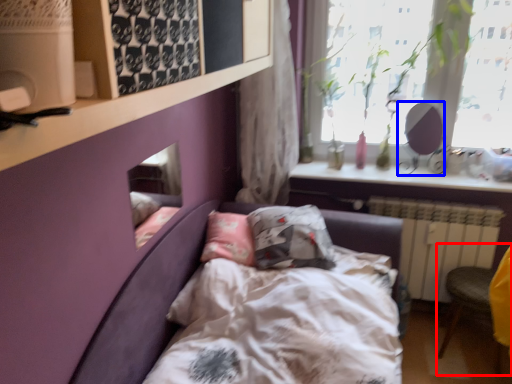
Question: Among these objects, which one is nearest to the camera, armchair (highlighted by a red box) or mirror (highlighted by a blue box)?

Choices:
 (A) armchair
 (B) mirror

Answer: (A)